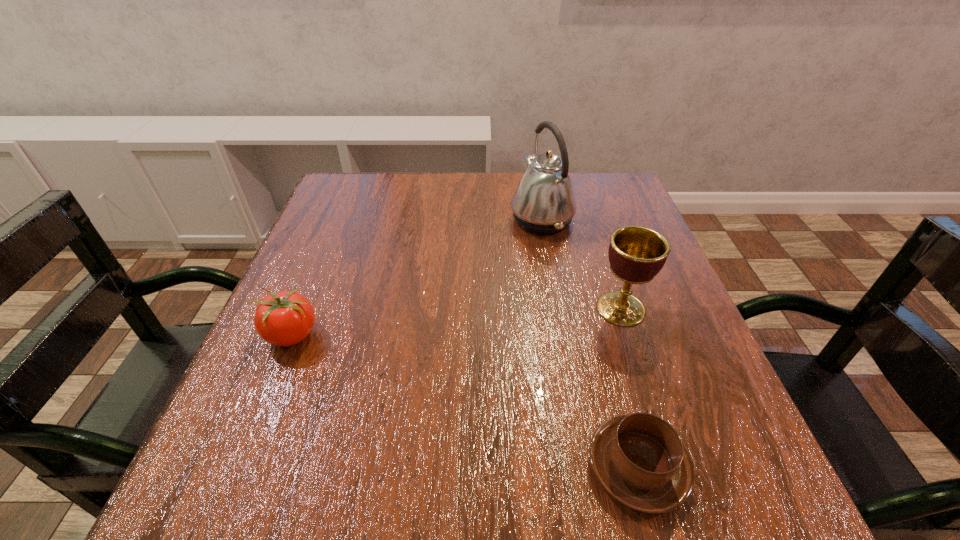
This screenshot has height=540, width=960. Find the location of `free location that satisfies the following two spatial constraints: 1. on the side of the cappuccino with the handle; 2. on the left side of the chalice`. free location that satisfies the following two spatial constraints: 1. on the side of the cappuccino with the handle; 2. on the left side of the chalice is located at coordinates (595, 309).

You are a GUI agent. You are given a task and a screenshot of the screen. Output one action in this format:
    pyautogui.click(x=<x>, y=<y>)
    Task: Click on the vacant area that satisfies the following two spatial constraints: 1. on the front side of the kettle; 2. on the right side of the third shortest object
    The height and width of the screenshot is (540, 960).
    Given the screenshot: What is the action you would take?
    pyautogui.click(x=558, y=309)